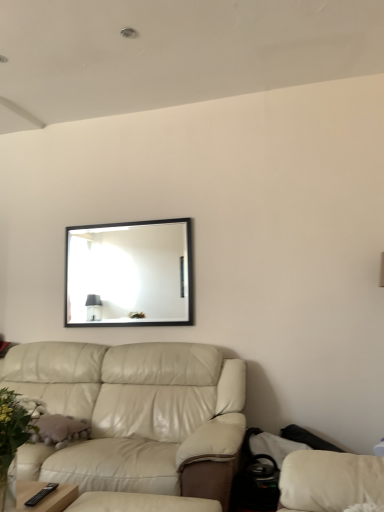
Question: From a real-world perspective, is black framed mirror at upper center located beneath green leafy plant at lower left?

Choices:
 (A) yes
 (B) no

Answer: (B)

Question: From a real-world perspective, is black framed mirror at upper center on green leafy plant at lower left?

Choices:
 (A) no
 (B) yes

Answer: (B)

Question: Is black framed mirror at upper center outside green leafy plant at lower left?

Choices:
 (A) yes
 (B) no

Answer: (A)

Question: Is black framed mirror at upper center turned away from green leafy plant at lower left?

Choices:
 (A) no
 (B) yes

Answer: (A)

Question: Considering the relative sizes of black framed mirror at upper center and green leafy plant at lower left in the image provided, is black framed mirror at upper center thinner than green leafy plant at lower left?

Choices:
 (A) yes
 (B) no

Answer: (A)

Question: Is black framed mirror at upper center positioned before green leafy plant at lower left?

Choices:
 (A) yes
 (B) no

Answer: (B)

Question: Can you confirm if leather couch at lower left is taller than black framed mirror at upper center?

Choices:
 (A) yes
 (B) no

Answer: (A)

Question: Can black framed mirror at upper center be found inside leather couch at lower left?

Choices:
 (A) no
 (B) yes

Answer: (A)

Question: Does leather couch at lower left touch black framed mirror at upper center?

Choices:
 (A) yes
 (B) no

Answer: (B)

Question: Could you tell me if leather couch at lower left is turned towards black framed mirror at upper center?

Choices:
 (A) no
 (B) yes

Answer: (A)

Question: Is the position of leather couch at lower left less distant than that of black framed mirror at upper center?

Choices:
 (A) no
 (B) yes

Answer: (B)

Question: Can you confirm if leather couch at lower left is positioned to the right of black framed mirror at upper center?

Choices:
 (A) no
 (B) yes

Answer: (A)

Question: Is green leafy plant at lower left bigger than leather couch at lower left?

Choices:
 (A) no
 (B) yes

Answer: (A)